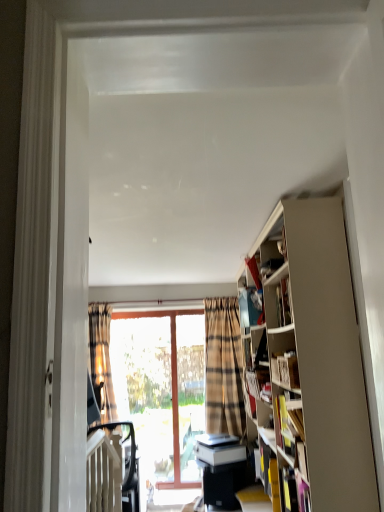
The height and width of the screenshot is (512, 384). What do you see at coordinates (288, 423) in the screenshot? I see `yellow paper at right, acting as the second book starting from the front` at bounding box center [288, 423].

What do you see at coordinates (126, 463) in the screenshot?
I see `black plastic swivel chair at lower left` at bounding box center [126, 463].

Measure the distance between black glossy table at lower center and camera.

black glossy table at lower center and camera are 3.70 meters apart from each other.

Image resolution: width=384 pixels, height=512 pixels. What do you see at coordinates (225, 482) in the screenshot?
I see `black glossy table at lower center` at bounding box center [225, 482].

Find the location of a particular element. yellow paper at right, acting as the second book starting from the front is located at coordinates (288, 423).

Is white matte bookshelf at right, the first book in the top-to-bottom sequence, located within black plastic swivel chair at lower left?

Actually, white matte bookshelf at right, the first book in the top-to-bottom sequence, is outside black plastic swivel chair at lower left.

Would you consider black plastic swivel chair at lower left to be distant from white matte bookshelf at right, which is counted as the 2th book, starting from the bottom?

Indeed, black plastic swivel chair at lower left is not near white matte bookshelf at right, which is counted as the 2th book, starting from the bottom.

From the image's perspective, relative to white matte bookshelf at right, which is counted as the 2th book, starting from the bottom, is black plastic swivel chair at lower left above or below?

black plastic swivel chair at lower left is below white matte bookshelf at right, which is counted as the 2th book, starting from the bottom.

Is black plastic swivel chair at lower left wider or thinner than white matte bookshelf at right, which is counted as the 2th book, starting from the bottom?

Considering their sizes, black plastic swivel chair at lower left looks broader than white matte bookshelf at right, which is counted as the 2th book, starting from the bottom.

Who is bigger, white matte bookshelf at right, the first book in the top-to-bottom sequence, or black glossy table at lower center?

Bigger between the two is black glossy table at lower center.

In terms of height, does white matte bookshelf at right, the first book in the top-to-bottom sequence, look taller or shorter compared to black glossy table at lower center?

In the image, white matte bookshelf at right, the first book in the top-to-bottom sequence, appears to be shorter than black glossy table at lower center.

From the image's perspective, is white matte bookshelf at right, which is counted as the 2th book, starting from the bottom, located above black glossy table at lower center?

Indeed, from the image's perspective, white matte bookshelf at right, which is counted as the 2th book, starting from the bottom, is shown above black glossy table at lower center.

From a real-world perspective, who is located higher, white matte bookshelf at right, which is counted as the 2th book, starting from the bottom, or black glossy table at lower center?

white matte bookshelf at right, which is counted as the 2th book, starting from the bottom, is physically above.

From the image's perspective, would you say black glossy table at lower center is positioned over plaid fabric curtain at left?

Actually, black glossy table at lower center appears below plaid fabric curtain at left in the image.

Would you say black glossy table at lower center is inside or outside plaid fabric curtain at left?

black glossy table at lower center is not inside plaid fabric curtain at left, it's outside.

Relative to plaid fabric curtain at left, is black glossy table at lower center in front or behind?

Clearly, black glossy table at lower center is in front of plaid fabric curtain at left.

Which is less distant, (90, 323) or (286, 443)?

The point (286, 443) is closer.

From a real-world perspective, which is physically below, plaid fabric curtain at left or yellow paper at right, the 1th book in the back-to-front sequence?

yellow paper at right, the 1th book in the back-to-front sequence.

Considering the relative positions of plaid fabric curtain at left and yellow paper at right, the 1th book in the back-to-front sequence, in the image provided, is plaid fabric curtain at left to the left or to the right of yellow paper at right, the 1th book in the back-to-front sequence,?

plaid fabric curtain at left is positioned on yellow paper at right, the 1th book in the back-to-front sequence,'s left side.

Are plaid fabric curtain at left and yellow paper at right, acting as the second book starting from the front, far apart?

plaid fabric curtain at left is positioned a significant distance from yellow paper at right, acting as the second book starting from the front.

The width and height of the screenshot is (384, 512). What are the coordinates of `book that is the 1st one when counting forward from the plaid fabric curtain at left` in the screenshot? It's located at (288, 423).

In the scene shown: From a real-world perspective, which object rests below the other?

From a 3D spatial view, yellow paper at right, arranged as the second book when viewed from the top, is below.

What's the angular difference between yellow paper at right, the 1th book in the back-to-front sequence, and plaid fabric curtain at left's facing directions?

There is a 96.5-degree angle between the facing directions of yellow paper at right, the 1th book in the back-to-front sequence, and plaid fabric curtain at left.

Is black plastic swivel chair at lower left far away from plaid fabric curtain at left?

No.

From a real-world perspective, who is located higher, black plastic swivel chair at lower left or plaid fabric curtain at left?

From a 3D spatial view, plaid fabric curtain at left is above.

Does point (126, 497) lie behind point (110, 376)?

No, it is not.

Which of these two, black plastic swivel chair at lower left or plaid fabric curtain at left, stands shorter?

black plastic swivel chair at lower left is shorter.

Is white matte bookshelf at right, placed as the first book when sorted from front to back, located outside black plastic swivel chair at lower left?

Yes, white matte bookshelf at right, placed as the first book when sorted from front to back, is not within black plastic swivel chair at lower left.

From the image's perspective, which object appears higher, white matte bookshelf at right, arranged as the second book when viewed from the back, or black plastic swivel chair at lower left?

white matte bookshelf at right, arranged as the second book when viewed from the back, is shown above in the image.

What's the angular difference between white matte bookshelf at right, placed as the first book when sorted from front to back, and black plastic swivel chair at lower left's facing directions?

59 degrees.

Considering the relative sizes of white matte bookshelf at right, the first book in the top-to-bottom sequence, and black plastic swivel chair at lower left in the image provided, is white matte bookshelf at right, the first book in the top-to-bottom sequence, wider than black plastic swivel chair at lower left?

Incorrect, the width of white matte bookshelf at right, the first book in the top-to-bottom sequence, does not surpass that of black plastic swivel chair at lower left.

In order to click on book that is the 2nd object located in front of the black plastic swivel chair at lower left in this screenshot , I will do `click(285, 369)`.

Locate an element on the screen. table lying behind the white matte bookshelf at right, placed as the first book when sorted from front to back is located at coordinates (225, 482).

Looking at the image, which one is located further to plaid fabric curtain at left, yellow paper at right, arranged as the second book when viewed from the top, or black plastic swivel chair at lower left?

yellow paper at right, arranged as the second book when viewed from the top, is positioned further to the anchor plaid fabric curtain at left.

Based on their spatial positions, is black plastic swivel chair at lower left or yellow paper at right, acting as the second book starting from the front, further from black glossy table at lower center?

Among the two, yellow paper at right, acting as the second book starting from the front, is located further to black glossy table at lower center.

Which object lies further to the anchor point yellow paper at right, arranged as the second book when viewed from the top, black glossy table at lower center or plaid fabric curtain at left?

plaid fabric curtain at left is further to yellow paper at right, arranged as the second book when viewed from the top.

Consider the image. Which object lies further to the anchor point yellow paper at right, acting as the second book starting from the front, clear glass screen door at center or plaid fabric curtain at left?

Based on the image, clear glass screen door at center appears to be further to yellow paper at right, acting as the second book starting from the front.

Considering their positions, is black glossy table at lower center positioned further to plaid fabric curtain at left than yellow paper at right, placed as the first book when sorted from bottom to top?

yellow paper at right, placed as the first book when sorted from bottom to top, is further to plaid fabric curtain at left.

Looking at the image, which one is located further to black glossy table at lower center, black plastic swivel chair at lower left or white matte bookshelf at right, the first book in the top-to-bottom sequence?

white matte bookshelf at right, the first book in the top-to-bottom sequence.

When comparing their distances from plaid fabric curtain at left, does black glossy table at lower center or clear glass screen door at center seem further?

black glossy table at lower center is further to plaid fabric curtain at left.

Estimate the real-world distances between objects in this image. Which object is closer to black plastic swivel chair at lower left, yellow paper at right, acting as the second book starting from the front, or plaid fabric curtain at left?

Based on the image, plaid fabric curtain at left appears to be nearer to black plastic swivel chair at lower left.

This screenshot has height=512, width=384. Find the location of `curtain between yellow paper at right, acting as the second book starting from the front, and clear glass screen door at center from front to back`. curtain between yellow paper at right, acting as the second book starting from the front, and clear glass screen door at center from front to back is located at coordinates click(x=101, y=360).

You are a GUI agent. You are given a task and a screenshot of the screen. Output one action in this format:
    pyautogui.click(x=<x>, y=<y>)
    Task: Click on the book between white matte bookshelf at right, placed as the first book when sorted from front to back, and plaid fabric curtain at left in the front-back direction
    The image size is (384, 512).
    Given the screenshot: What is the action you would take?
    pyautogui.click(x=288, y=423)

Identify the location of swivel chair between yellow paper at right, the 1th book in the back-to-front sequence, and clear glass screen door at center, along the z-axis. This screenshot has width=384, height=512. (126, 463).

Find the location of `table located between black plastic swivel chair at lower left and clear glass screen door at center in the depth direction`. table located between black plastic swivel chair at lower left and clear glass screen door at center in the depth direction is located at coordinates (225, 482).